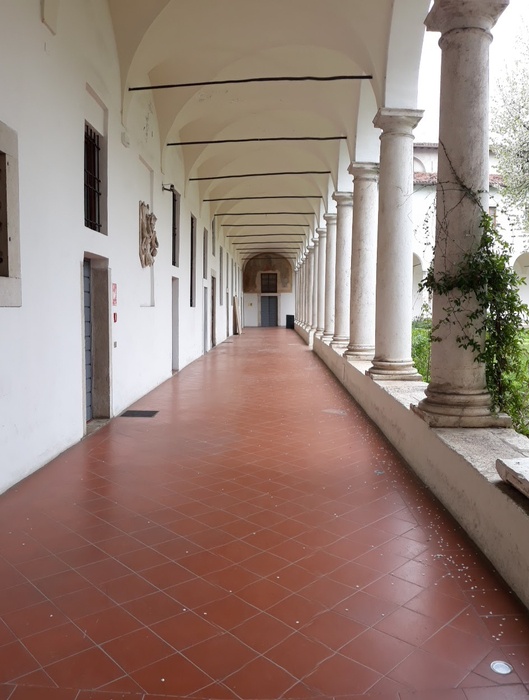
Identify the location of doorway. The height and width of the screenshot is (700, 529). (96, 337).